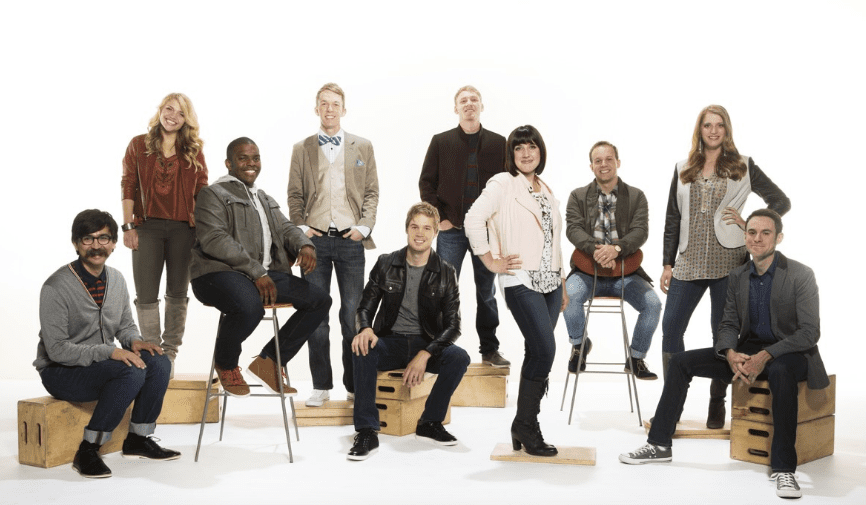
Identify the location of brown boxes. (48, 413), (165, 410), (392, 417), (392, 388), (494, 381), (732, 407), (740, 431).